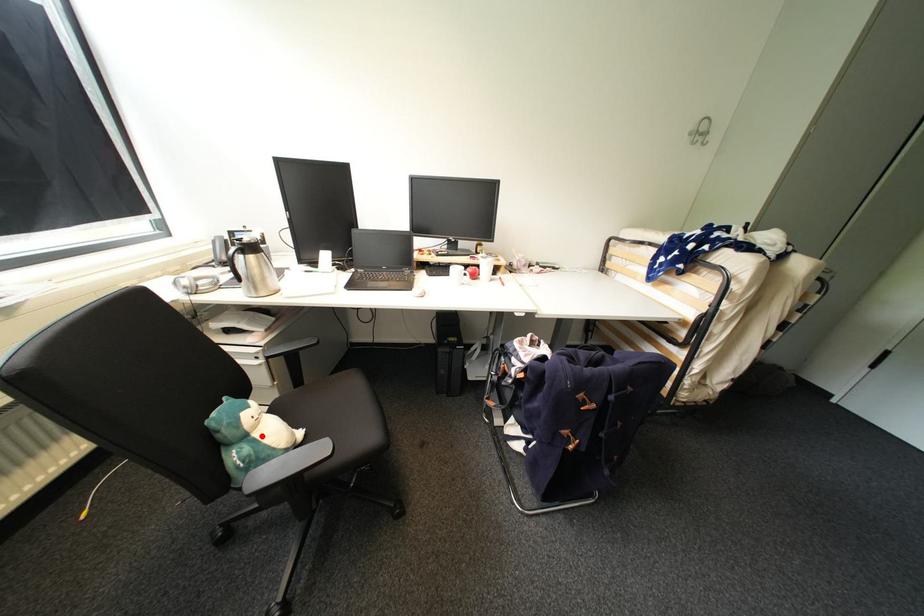
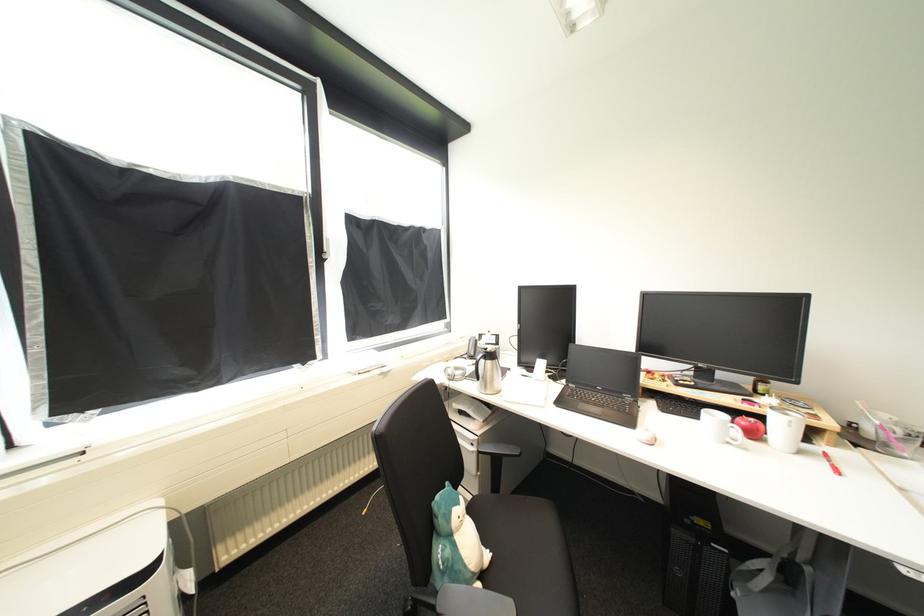
Find the pixel in the second image that matches the highlighted location in the first image.

(464, 538)